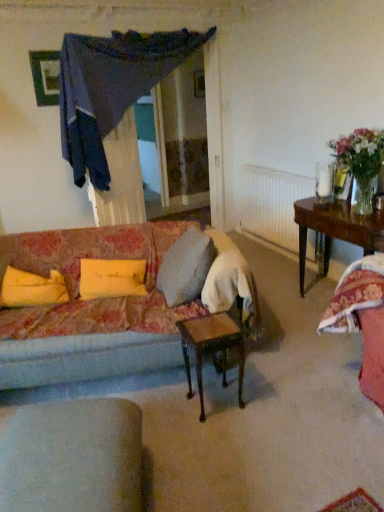
I want to click on free spot above wooden table at center, the second table when ordered from right to left (from a real-world perspective), so click(210, 325).